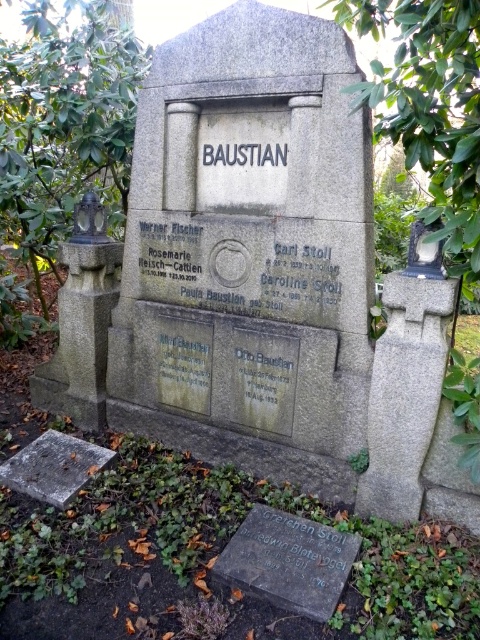
Is green leafy tree at center positioned before green leafy tree at upper center?

No.

This screenshot has height=640, width=480. What are the coordinates of `green leafy tree at center` in the screenshot? It's located at 60,136.